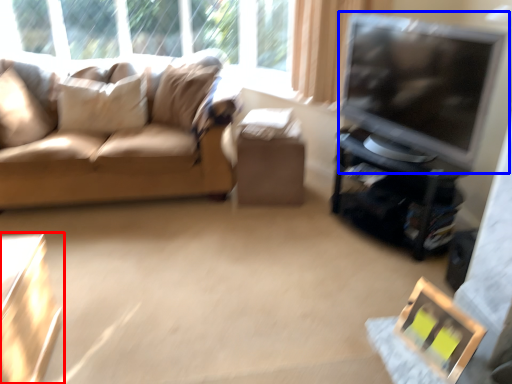
Question: Which object is further to the camera taking this photo, table (highlighted by a red box) or television (highlighted by a blue box)?

Choices:
 (A) table
 (B) television

Answer: (B)